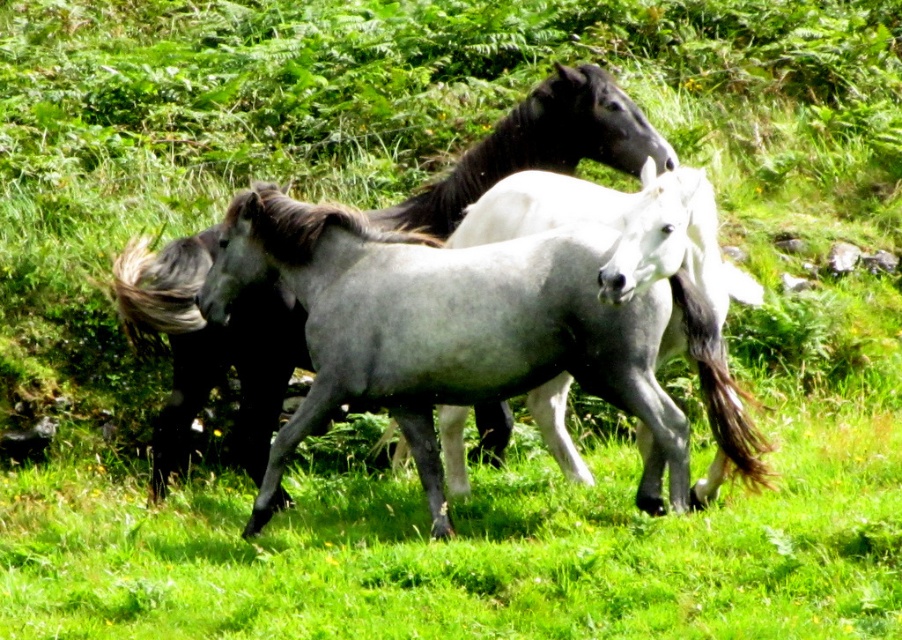
You are a photographer trying to capture the two horses in the image. You want to ensure that both the gray glossy horse at center and the white glossy horse at center fit entirely within your camera frame. Given that your camera has a fixed width of 1 meter, which horse requires more space horizontally to be fully captured?

The white glossy horse at center requires more horizontal space because its width is greater than the gray glossy horse at center, as stated in the description.

You are a photographer trying to capture a photo of the gray glossy horse at center and the white glossy horse at center. The camera you are using has a maximum focus range of 1.5 meters. Can you fit both horses in the frame without moving your position?

The gray glossy horse at center and white glossy horse at center are 1.34 meters apart, which is within the camera maximum focus range of 1.5 meters. Therefore, you can fit both horses in the frame without moving your position.